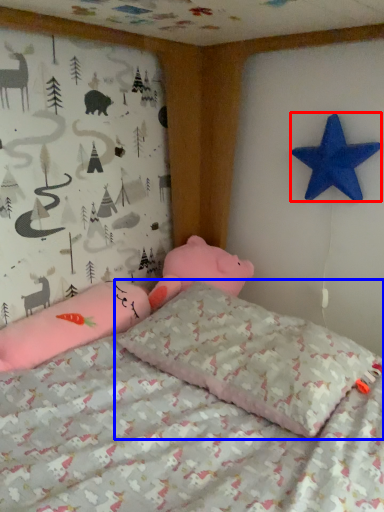
Question: Among these objects, which one is nearest to the camera, starfish (highlighted by a red box) or pillow (highlighted by a blue box)?

Choices:
 (A) starfish
 (B) pillow

Answer: (B)